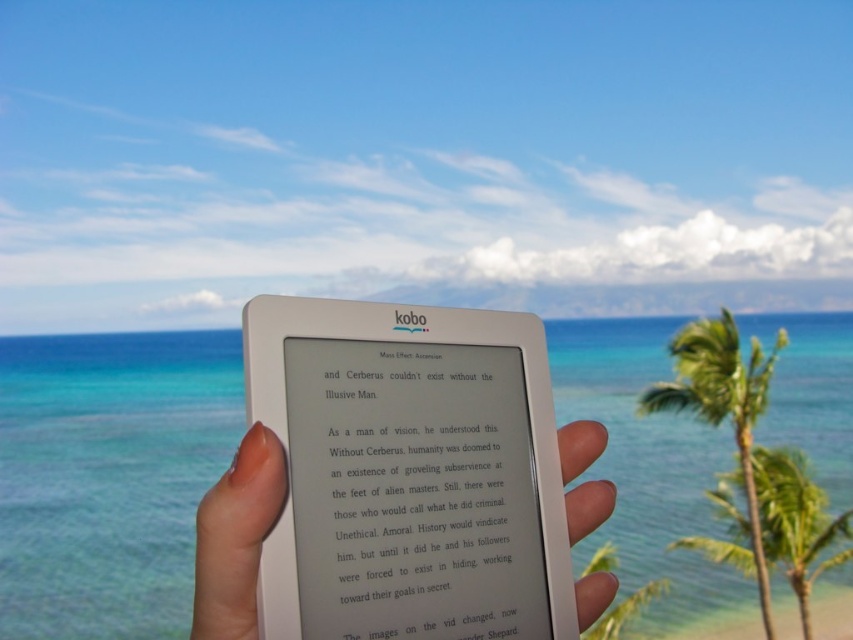
Question: Which point is farther to the camera?

Choices:
 (A) green leafy palm tree at right
 (B) smooth skin hand at center

Answer: (A)

Question: Which point appears farthest from the camera in this image?

Choices:
 (A) (260, 508)
 (B) (718, 401)

Answer: (B)

Question: Can you confirm if smooth skin hand at center is smaller than green leafy palm tree at right?

Choices:
 (A) no
 (B) yes

Answer: (B)

Question: In this image, where is smooth skin hand at center located relative to green leafy palm tree at right?

Choices:
 (A) left
 (B) right

Answer: (A)

Question: Which point is farther to the camera?

Choices:
 (A) green leafy palm tree at right
 (B) smooth skin hand at center

Answer: (A)

Question: Can you confirm if smooth skin hand at center is thinner than green leafy palm tree at right?

Choices:
 (A) no
 (B) yes

Answer: (B)